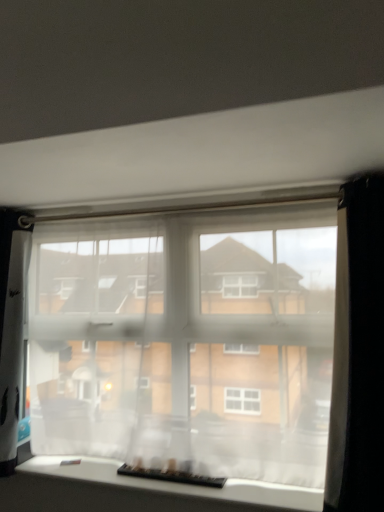
This screenshot has width=384, height=512. What do you see at coordinates (171, 476) in the screenshot?
I see `black plastic keyboard at lower center` at bounding box center [171, 476].

Locate an element on the screen. The width and height of the screenshot is (384, 512). black plastic keyboard at lower center is located at coordinates (171, 476).

This screenshot has width=384, height=512. Find the location of `translucent fabric at bottom, which is counted as the 1th window, starting from the bottom`. translucent fabric at bottom, which is counted as the 1th window, starting from the bottom is located at coordinates (177, 484).

Locate an element on the screen. The height and width of the screenshot is (512, 384). translucent fabric at center, which appears as the 2th window when ordered from the bottom is located at coordinates (187, 340).

Which is correct: translucent fabric at center, which appears as the 2th window when ordered from the bottom, is inside black sheer curtain at right, or outside of it?

translucent fabric at center, which appears as the 2th window when ordered from the bottom, exists outside the volume of black sheer curtain at right.

Considering the points (96, 286) and (341, 275), which point is in front, point (96, 286) or point (341, 275)?

Point (341, 275)

Who is shorter, translucent fabric at center, which appears as the 1th window when viewed from the top, or black sheer curtain at right?

With less height is translucent fabric at center, which appears as the 1th window when viewed from the top.

Considering the sizes of objects black plastic keyboard at lower center and black sheer curtain at right in the image provided, who is wider, black plastic keyboard at lower center or black sheer curtain at right?

With larger width is black sheer curtain at right.

Is black plastic keyboard at lower center oriented away from black sheer curtain at right?

That's not correct — black plastic keyboard at lower center is not looking away from black sheer curtain at right.

The image size is (384, 512). Identify the location of level behind the black sheer curtain at right. (171, 476).

Is black sheer curtain at right smaller than translucent fabric at bottom, which is counted as the 1th window, starting from the bottom?

No.

Is black sheer curtain at right wider than translucent fabric at bottom, which is counted as the 1th window, starting from the bottom?

No.

Does black sheer curtain at right have a greater height compared to translucent fabric at bottom, which is counted as the 1th window, starting from the bottom?

Yes.

Which is farther from the camera, [313,207] or [167,473]?

Positioned behind is point [313,207].

Is translucent fabric at center, which appears as the 1th window when viewed from the top, far from black plastic keyboard at lower center?

That's not correct — translucent fabric at center, which appears as the 1th window when viewed from the top, is a little close to black plastic keyboard at lower center.

How many degrees apart are the facing directions of translucent fabric at center, which appears as the 1th window when viewed from the top, and black plastic keyboard at lower center?

There is a 0.00579-degree angle between the facing directions of translucent fabric at center, which appears as the 1th window when viewed from the top, and black plastic keyboard at lower center.

Does translucent fabric at center, which appears as the 2th window when ordered from the bottom, appear on the right side of black plastic keyboard at lower center?

Yes.

Considering the sizes of objects black plastic keyboard at lower center and translucent fabric at bottom, which is counted as the 1th window, starting from the bottom, in the image provided, who is shorter, black plastic keyboard at lower center or translucent fabric at bottom, which is counted as the 1th window, starting from the bottom,?

black plastic keyboard at lower center is shorter.

Looking at this image, how many degrees apart are the facing directions of black plastic keyboard at lower center and translucent fabric at bottom, which is counted as the 1th window, starting from the bottom?

0.00231 degrees separate the facing orientations of black plastic keyboard at lower center and translucent fabric at bottom, which is counted as the 1th window, starting from the bottom.

Which is behind, point (202, 481) or point (304, 494)?

Positioned behind is point (202, 481).

In the scene shown: Is translucent fabric at bottom, which is counted as the 1th window, starting from the bottom, aimed at black sheer curtain at right?

No, translucent fabric at bottom, which is counted as the 1th window, starting from the bottom, is not aimed at black sheer curtain at right.

Find the location of a particular element. Image resolution: width=384 pixels, height=512 pixels. window that is the 2nd one when counting leftward from the black sheer curtain at right is located at coordinates (177, 484).

Which of these two, translucent fabric at bottom, marked as the 2th window in a top-to-bottom arrangement, or black sheer curtain at right, is bigger?

With larger size is black sheer curtain at right.

Between translucent fabric at bottom, which is counted as the 1th window, starting from the bottom, and black sheer curtain at right, which one has smaller width?

black sheer curtain at right is thinner.

Is translucent fabric at center, which appears as the 2th window when ordered from the bottom, surrounded by translucent fabric at bottom, which is counted as the 1th window, starting from the bottom?

No.

How many degrees apart are the facing directions of translucent fabric at bottom, marked as the 2th window in a top-to-bottom arrangement, and translucent fabric at center, which appears as the 1th window when viewed from the top?

The angle between the facing direction of translucent fabric at bottom, marked as the 2th window in a top-to-bottom arrangement, and the facing direction of translucent fabric at center, which appears as the 1th window when viewed from the top, is 0.0051 degrees.

Is the position of translucent fabric at bottom, marked as the 2th window in a top-to-bottom arrangement, less distant than that of translucent fabric at center, which appears as the 2th window when ordered from the bottom?

That is True.

Is point (260, 487) behind point (88, 440)?

No, it is in front of (88, 440).

Find the location of a particular element. curtain lying on the right of translucent fabric at center, which appears as the 2th window when ordered from the bottom is located at coordinates (358, 352).

Locate an element on the screen. curtain above the black plastic keyboard at lower center (from a real-world perspective) is located at coordinates (358, 352).

Looking at the image, which one is located closer to translucent fabric at center, which appears as the 1th window when viewed from the top, translucent fabric at bottom, which is counted as the 1th window, starting from the bottom, or black sheer curtain at right?

Based on the image, translucent fabric at bottom, which is counted as the 1th window, starting from the bottom, appears to be nearer to translucent fabric at center, which appears as the 1th window when viewed from the top.

From the image, which object appears to be nearer to translucent fabric at bottom, marked as the 2th window in a top-to-bottom arrangement, translucent fabric at center, which appears as the 2th window when ordered from the bottom, or black sheer curtain at right?

translucent fabric at center, which appears as the 2th window when ordered from the bottom, is positioned closer to the anchor translucent fabric at bottom, marked as the 2th window in a top-to-bottom arrangement.

From the picture: Based on their spatial positions, is black plastic keyboard at lower center or black sheer curtain at right closer to translucent fabric at bottom, marked as the 2th window in a top-to-bottom arrangement?

black plastic keyboard at lower center is positioned closer to the anchor translucent fabric at bottom, marked as the 2th window in a top-to-bottom arrangement.

Estimate the real-world distances between objects in this image. Which object is closer to translucent fabric at center, which appears as the 1th window when viewed from the top, black sheer curtain at right or translucent fabric at bottom, marked as the 2th window in a top-to-bottom arrangement?

translucent fabric at bottom, marked as the 2th window in a top-to-bottom arrangement.

Which object lies nearer to the anchor point black plastic keyboard at lower center, translucent fabric at center, which appears as the 2th window when ordered from the bottom, or translucent fabric at bottom, which is counted as the 1th window, starting from the bottom?

Among the two, translucent fabric at bottom, which is counted as the 1th window, starting from the bottom, is located nearer to black plastic keyboard at lower center.

Estimate the real-world distances between objects in this image. Which object is further from black sheer curtain at right, black plastic keyboard at lower center or translucent fabric at center, which appears as the 1th window when viewed from the top?

black plastic keyboard at lower center lies further to black sheer curtain at right than the other object.

Looking at the image, which one is located further to black plastic keyboard at lower center, translucent fabric at center, which appears as the 2th window when ordered from the bottom, or black sheer curtain at right?

The object further to black plastic keyboard at lower center is black sheer curtain at right.

From the image, which object appears to be nearer to black sheer curtain at right, translucent fabric at bottom, marked as the 2th window in a top-to-bottom arrangement, or translucent fabric at center, which appears as the 2th window when ordered from the bottom?

Based on the image, translucent fabric at center, which appears as the 2th window when ordered from the bottom, appears to be nearer to black sheer curtain at right.

Locate an element on the screen. This screenshot has width=384, height=512. window between black sheer curtain at right and black plastic keyboard at lower center in the vertical direction is located at coordinates (187, 340).

Locate an element on the screen. This screenshot has height=512, width=384. level situated between translucent fabric at bottom, which is counted as the 1th window, starting from the bottom, and black sheer curtain at right from left to right is located at coordinates (171, 476).

You are a GUI agent. You are given a task and a screenshot of the screen. Output one action in this format:
    pyautogui.click(x=<x>, y=<y>)
    Task: Click on the window that lies between black sheer curtain at right and translucent fabric at bottom, marked as the 2th window in a top-to-bottom arrangement, from top to bottom
    This screenshot has width=384, height=512.
    Given the screenshot: What is the action you would take?
    pyautogui.click(x=187, y=340)

You are a GUI agent. You are given a task and a screenshot of the screen. Output one action in this format:
    pyautogui.click(x=<x>, y=<y>)
    Task: Click on the level between translucent fabric at center, which appears as the 2th window when ordered from the bottom, and translucent fabric at bottom, marked as the 2th window in a top-to-bottom arrangement, in the vertical direction
    This screenshot has height=512, width=384.
    Given the screenshot: What is the action you would take?
    [x=171, y=476]